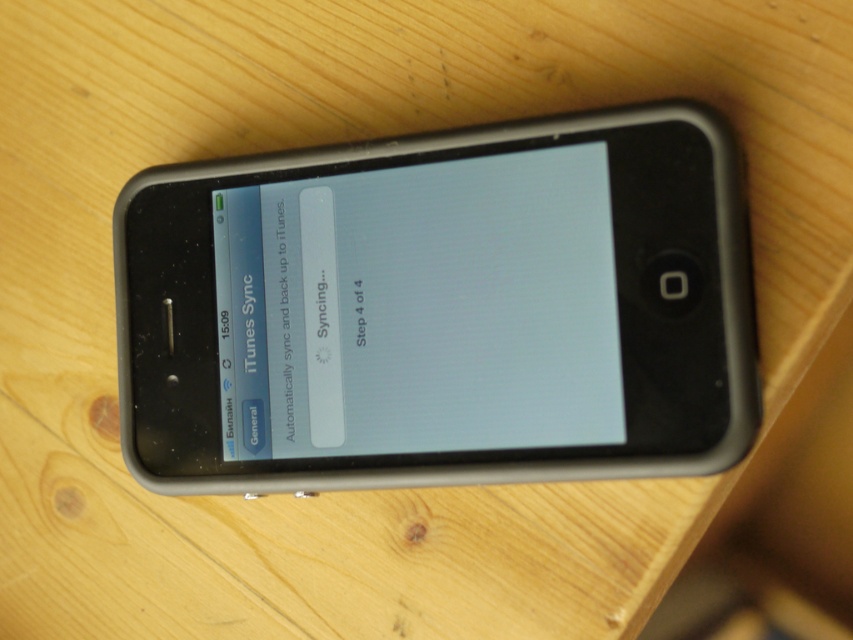
You are looking at the smartphone screen. Which object is positioned higher on the screen, the matte black screen at center or the white matte text message at upper left?

The matte black screen at center is located above the white matte text message at upper left, so the matte black screen at center is positioned higher on the screen.

You are holding a smartphone and notice two elements on the display. Which object is closer to you, the matte black screen at center or the white matte text message at upper left?

The matte black screen at center is closer to you because it is in front of the white matte text message at upper left.

You are holding a smartphone with a matte black screen at center and a white matte text message at upper left. If you want to read the message clearly, which part of the phone should you look at more closely?

You should look at the white matte text message at upper left more closely because it contains the text that needs to be read, while the matte black screen at center is larger but serves as the background.